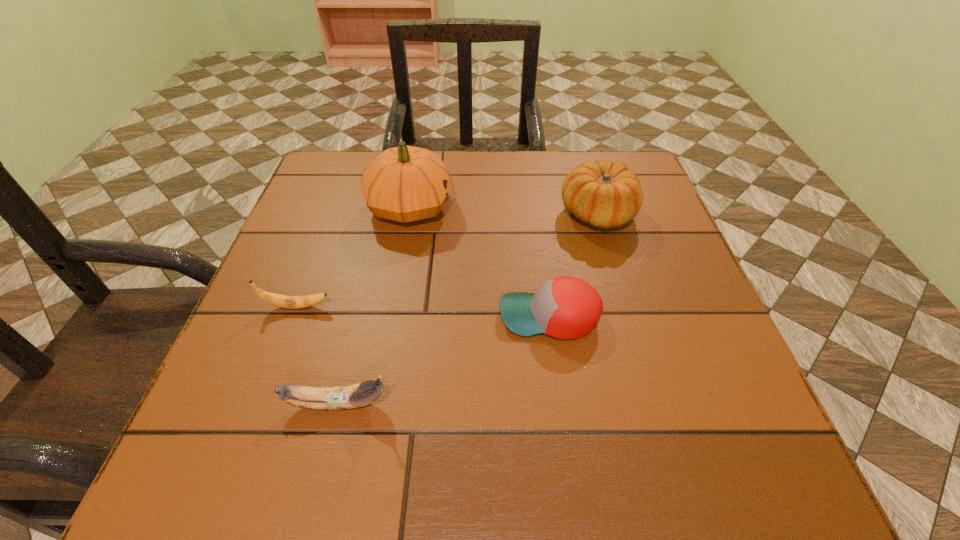
What are the coordinates of `blank region between the fourth shortest object and the shorter banana` in the screenshot? It's located at (447, 260).

Find the location of a particular element. The height and width of the screenshot is (540, 960). empty space that is in between the farther banana and the shorter gourd is located at coordinates [447, 260].

Locate an element on the screen. free space between the baseball cap and the third tallest object is located at coordinates (444, 360).

At what (x,y) coordinates should I click in order to perform the action: click on vacant space in between the tallest object and the third shortest object. Please return your answer as a coordinate pair (x, y). The height and width of the screenshot is (540, 960). Looking at the image, I should click on (374, 306).

The height and width of the screenshot is (540, 960). What are the coordinates of `empty space between the shorter gourd and the third tallest object` in the screenshot? It's located at (468, 309).

I want to click on free space between the taller banana and the shorter gourd, so click(x=468, y=309).

Image resolution: width=960 pixels, height=540 pixels. I want to click on vacant area between the fourth shortest object and the taller banana, so click(468, 309).

Locate which object is the closest to the shorter banana. Please provide its 2D coordinates. Your answer should be formatted as a tuple, i.e. [(x, y)], where the tuple contains the x and y coordinates of a point satisfying the conditions above.

[(357, 395)]

Locate which object ranks fourth in proximity to the farther banana. Please provide its 2D coordinates. Your answer should be formatted as a tuple, i.e. [(x, y)], where the tuple contains the x and y coordinates of a point satisfying the conditions above.

[(605, 195)]

Locate an element on the screen. free space that satisfies the following two spatial constraints: 1. on the front side of the shorter gourd; 2. at the brim of the baseball cap is located at coordinates click(629, 316).